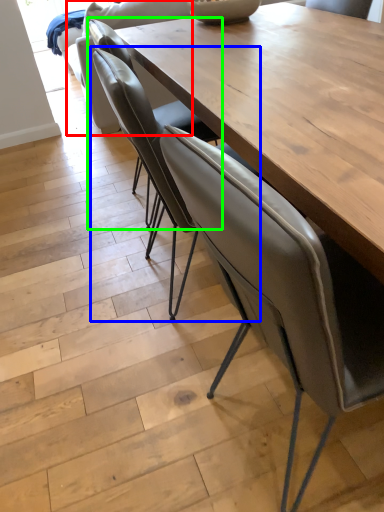
Question: Which object is positioned closest to armchair (highlighted by a red box)? Select from chair (highlighted by a blue box) and chair (highlighted by a green box).

Choices:
 (A) chair
 (B) chair

Answer: (B)